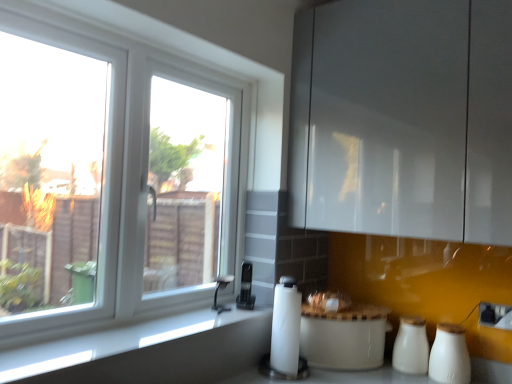
Image resolution: width=512 pixels, height=384 pixels. Identify the location of vacant area situated to the left side of satin nickel faucet at lower center. (186, 314).